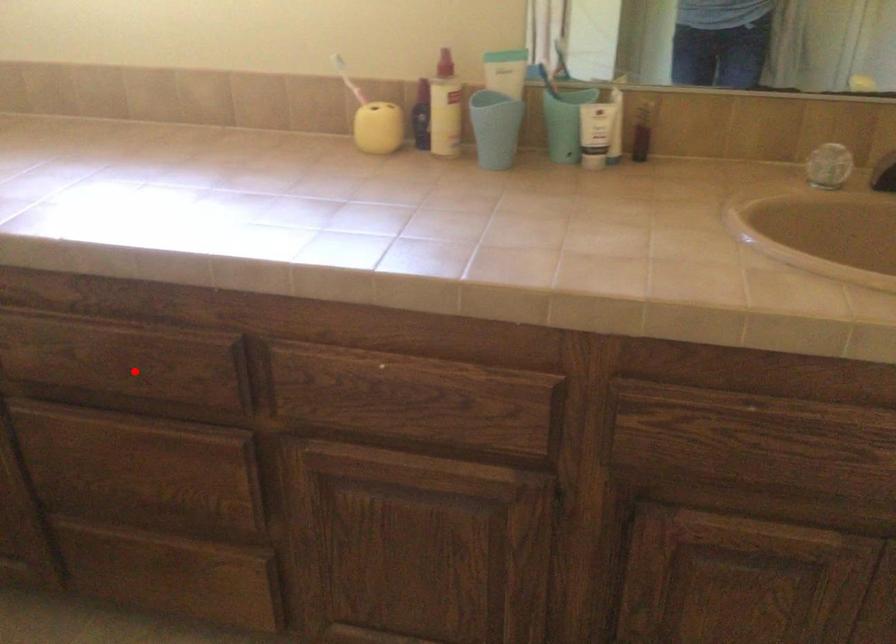
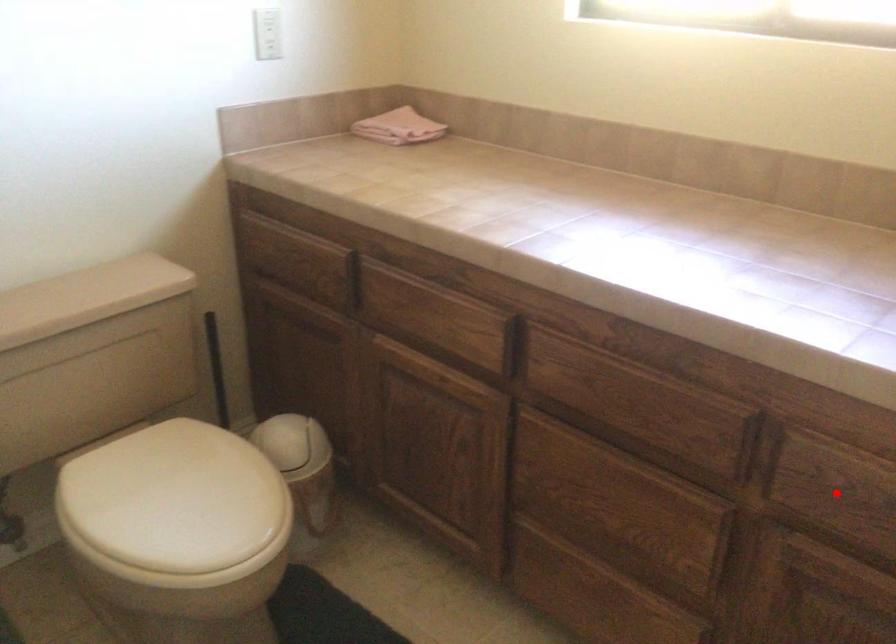
I am providing you with two images of the same scene from different viewpoints. A red point is marked on the first image and another point is marked on the second image. Are the points marked in image1 and image2 representing the same 3D position?

No